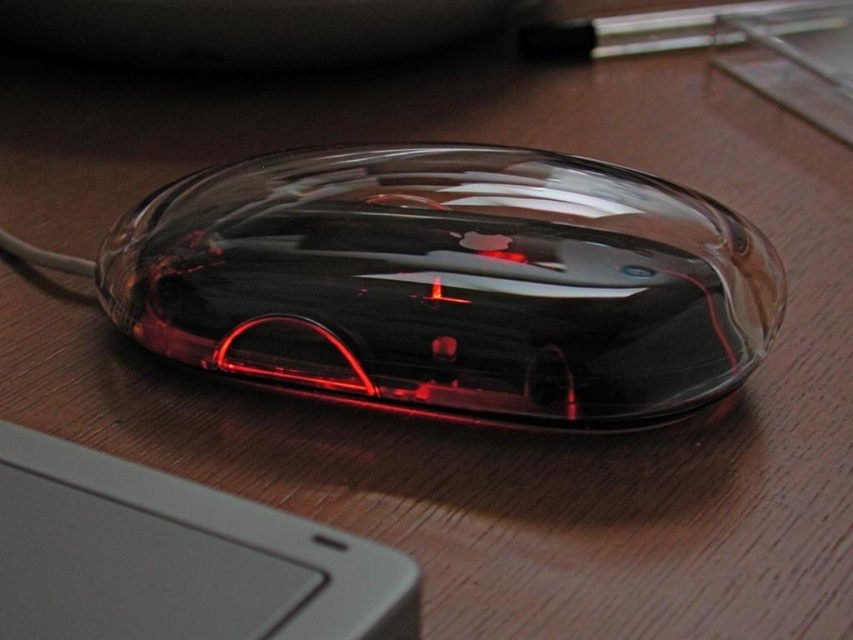
Question: Which of the following is the farthest from the observer?

Choices:
 (A) transparent plastic mouse at center
 (B) gray matte keyboard at lower left

Answer: (A)

Question: Can you confirm if transparent plastic mouse at center is smaller than gray matte keyboard at lower left?

Choices:
 (A) yes
 (B) no

Answer: (B)

Question: Which of the following is the farthest from the observer?

Choices:
 (A) transparent plastic mouse at center
 (B) gray matte keyboard at lower left

Answer: (A)

Question: Does transparent plastic mouse at center come behind gray matte keyboard at lower left?

Choices:
 (A) yes
 (B) no

Answer: (A)

Question: Does transparent plastic mouse at center appear under gray matte keyboard at lower left?

Choices:
 (A) no
 (B) yes

Answer: (A)